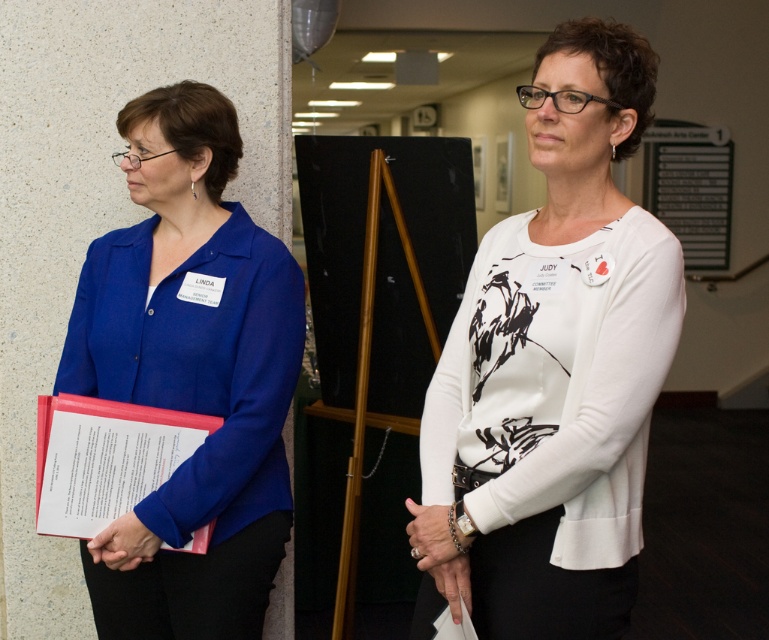
Question: Is white matte sweater at center to the left of blue matte blazer at left from the viewer's perspective?

Choices:
 (A) yes
 (B) no

Answer: (B)

Question: In this image, where is white matte sweater at center located relative to blue matte blazer at left?

Choices:
 (A) right
 (B) left

Answer: (A)

Question: Which point is farther to the camera?

Choices:
 (A) (248, 358)
 (B) (604, 481)

Answer: (A)

Question: Observing the image, what is the correct spatial positioning of white matte sweater at center in reference to blue matte blazer at left?

Choices:
 (A) right
 (B) left

Answer: (A)

Question: Which object appears farthest from the camera in this image?

Choices:
 (A) blue matte blazer at left
 (B) white matte sweater at center

Answer: (A)